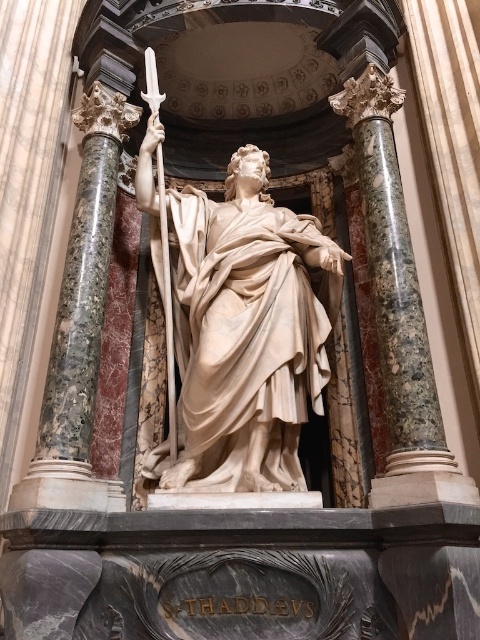
Question: Is matte white statue at center bigger than green marble column at right?

Choices:
 (A) yes
 (B) no

Answer: (A)

Question: Which object is farther from the camera taking this photo?

Choices:
 (A) green marble column at right
 (B) green marble column at center

Answer: (B)

Question: Which of the following is the closest to the observer?

Choices:
 (A) [374, 116]
 (B) [48, 387]
 (C) [191, 392]

Answer: (B)

Question: Can you confirm if green marble column at right is bigger than green marble column at center?

Choices:
 (A) yes
 (B) no

Answer: (A)

Question: Is matte white statue at center closer to the viewer compared to polished silver sword at center?

Choices:
 (A) yes
 (B) no

Answer: (A)

Question: Which object is closer to the camera taking this photo?

Choices:
 (A) polished silver sword at center
 (B) matte white statue at center
 (C) green marble column at center

Answer: (C)